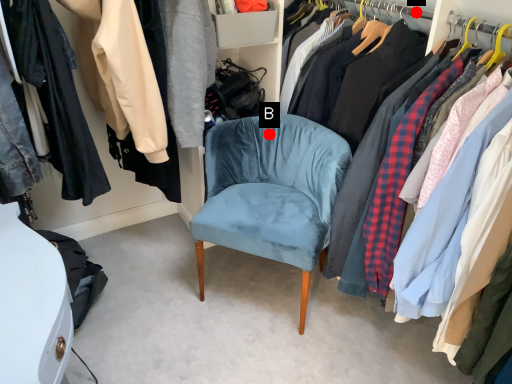
Question: Two points are circled on the image, labeled by A and B beside each circle. Which point is farther to the camera?

Choices:
 (A) A is further
 (B) B is further

Answer: (A)